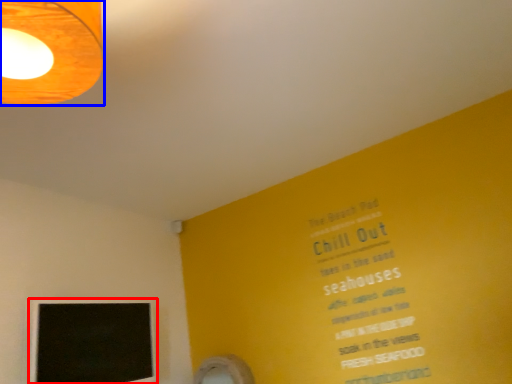
Question: Which object appears farthest to the camera in this image, computer monitor (highlighted by a red box) or lamp (highlighted by a blue box)?

Choices:
 (A) computer monitor
 (B) lamp

Answer: (A)